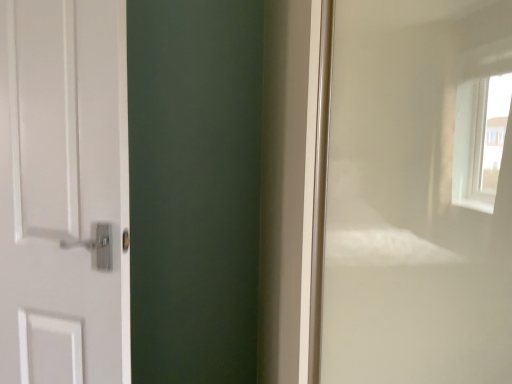
Question: From a real-world perspective, is white glossy window frame at right beneath white matte door at left?

Choices:
 (A) yes
 (B) no

Answer: (A)

Question: Is white glossy window frame at right facing towards white matte door at left?

Choices:
 (A) yes
 (B) no

Answer: (B)

Question: Can you confirm if white glossy window frame at right is thinner than white matte door at left?

Choices:
 (A) yes
 (B) no

Answer: (B)

Question: Is white glossy window frame at right to the left of white matte door at left from the viewer's perspective?

Choices:
 (A) no
 (B) yes

Answer: (A)

Question: Can you confirm if white glossy window frame at right is shorter than white matte door at left?

Choices:
 (A) no
 (B) yes

Answer: (A)

Question: Is white matte door at left inside white glossy window frame at right?

Choices:
 (A) no
 (B) yes

Answer: (A)

Question: Is white matte door at left far from white glossy window frame at right?

Choices:
 (A) yes
 (B) no

Answer: (B)

Question: Can you confirm if white matte door at left is bigger than white glossy window frame at right?

Choices:
 (A) no
 (B) yes

Answer: (A)

Question: Is white matte door at left next to white glossy window frame at right and touching it?

Choices:
 (A) no
 (B) yes

Answer: (A)

Question: Is white matte door at left wider than white glossy window frame at right?

Choices:
 (A) no
 (B) yes

Answer: (A)

Question: From a real-world perspective, is white matte door at left positioned over white glossy window frame at right based on gravity?

Choices:
 (A) no
 (B) yes

Answer: (B)

Question: Considering the relative sizes of white matte door at left and white glossy window frame at right in the image provided, is white matte door at left taller than white glossy window frame at right?

Choices:
 (A) yes
 (B) no

Answer: (B)

Question: From their relative heights in the image, would you say white matte door at left is taller or shorter than white glossy window frame at right?

Choices:
 (A) tall
 (B) short

Answer: (B)